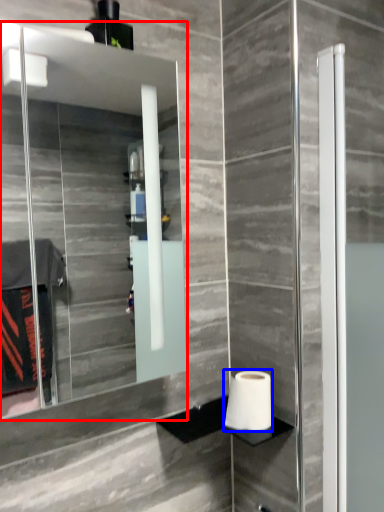
Question: Which of the following is the closest to the observer, mirror (highlighted by a red box) or toilet paper (highlighted by a blue box)?

Choices:
 (A) mirror
 (B) toilet paper

Answer: (A)